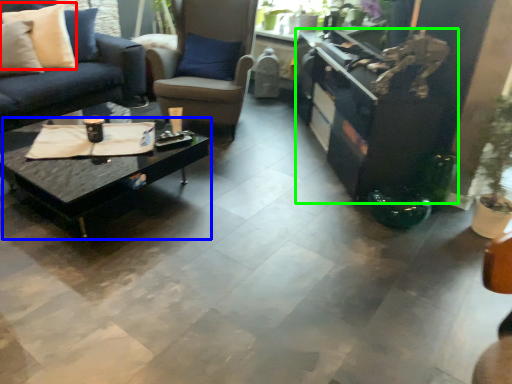
Question: Which object is the closest to the pillow (highlighted by a red box)? Choose among these: coffee table (highlighted by a blue box) or entertainment center (highlighted by a green box).

Choices:
 (A) coffee table
 (B) entertainment center

Answer: (A)